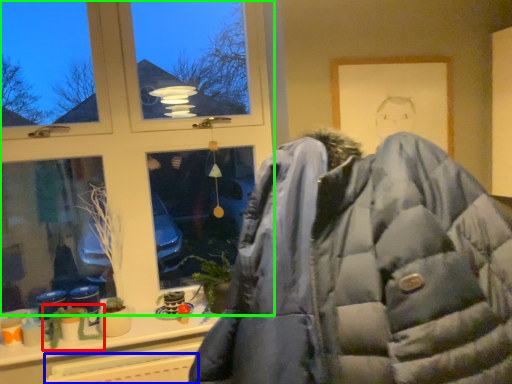
Question: Estimate the real-world distances between objects in this image. Which object is closer to plant (highlighted by a red box), radiator (highlighted by a blue box) or window (highlighted by a green box)?

Choices:
 (A) radiator
 (B) window

Answer: (A)